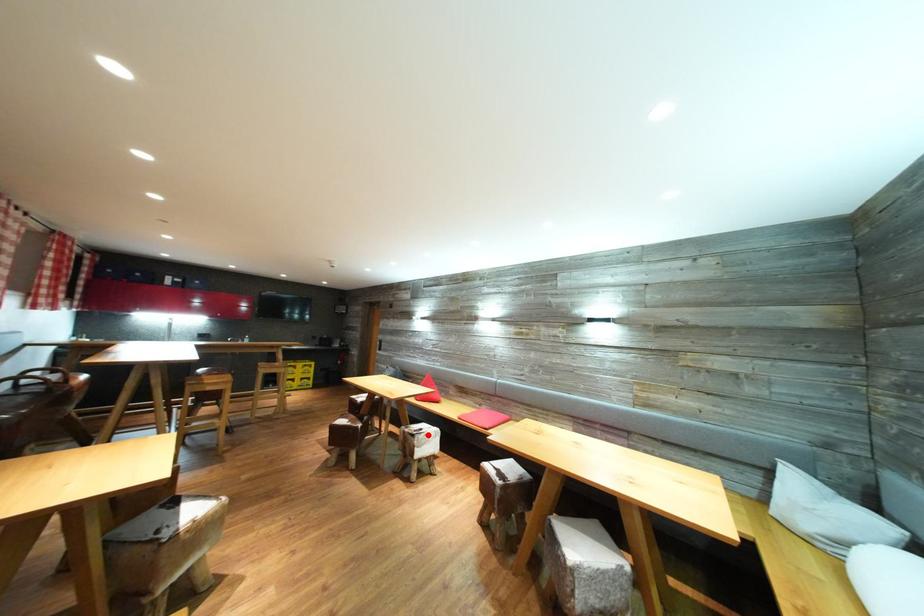
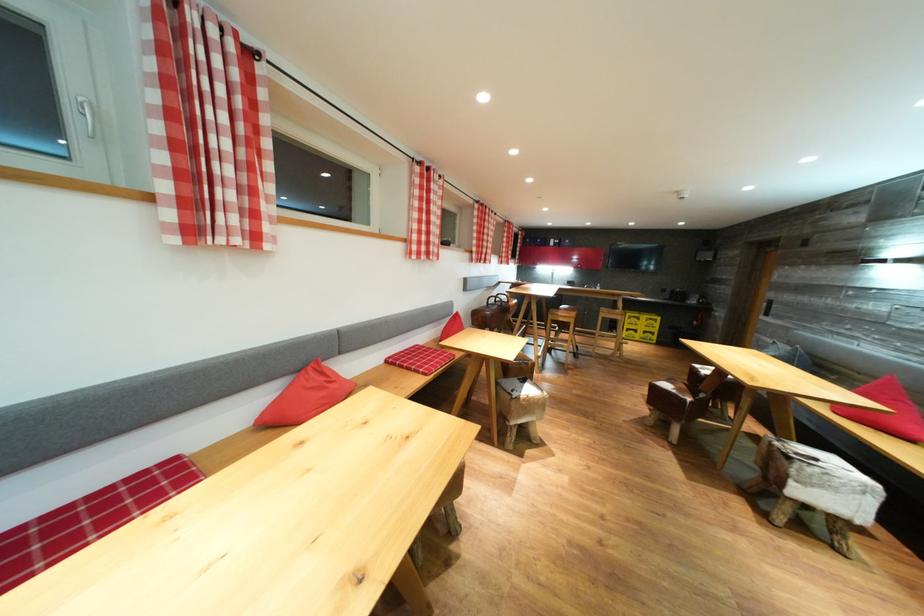
Locate, in the second image, the point that corresponds to the highlighted location in the first image.

(821, 464)